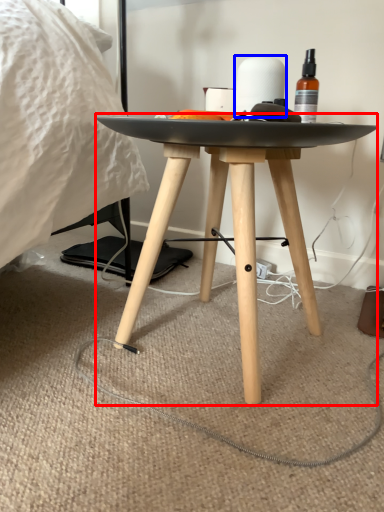
Question: Among these objects, which one is farthest to the camera, table (highlighted by a red box) or toilet paper (highlighted by a blue box)?

Choices:
 (A) table
 (B) toilet paper

Answer: (B)